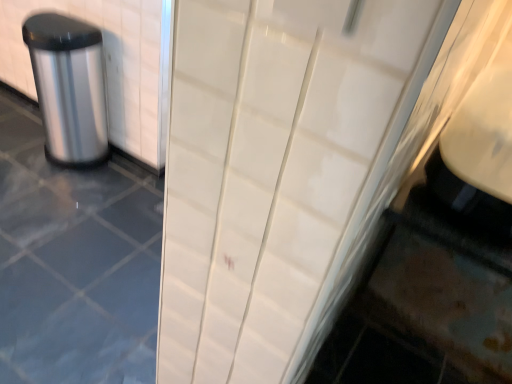
Measure the distance between polished stainless steel trash can at left and camera.

polished stainless steel trash can at left and camera are 1.70 meters apart from each other.

This screenshot has height=384, width=512. Describe the element at coordinates (69, 87) in the screenshot. I see `polished stainless steel trash can at left` at that location.

In order to click on polished stainless steel trash can at left in this screenshot , I will do `click(69, 87)`.

Where is `polished stainless steel trash can at left`? This screenshot has width=512, height=384. polished stainless steel trash can at left is located at coordinates (69, 87).